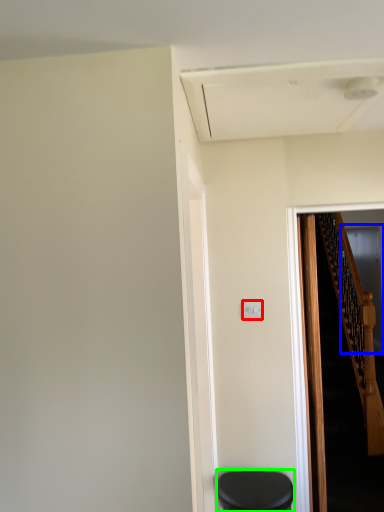
Question: Considering the real-world distances, which object is farthest from electric outlet (highlighted by a red box)? glass door (highlighted by a blue box) or furniture (highlighted by a green box)?

Choices:
 (A) glass door
 (B) furniture

Answer: (A)